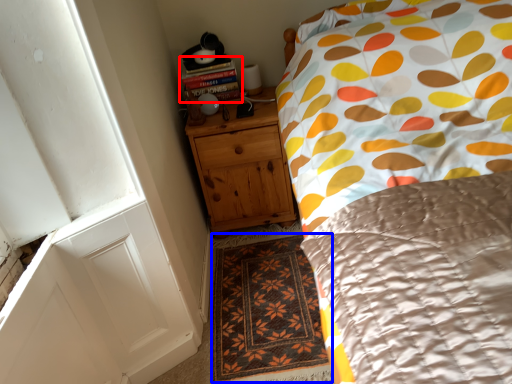
Question: Which of the following is the farthest to the observer, book (highlighted by a red box) or doormat (highlighted by a blue box)?

Choices:
 (A) book
 (B) doormat

Answer: (A)